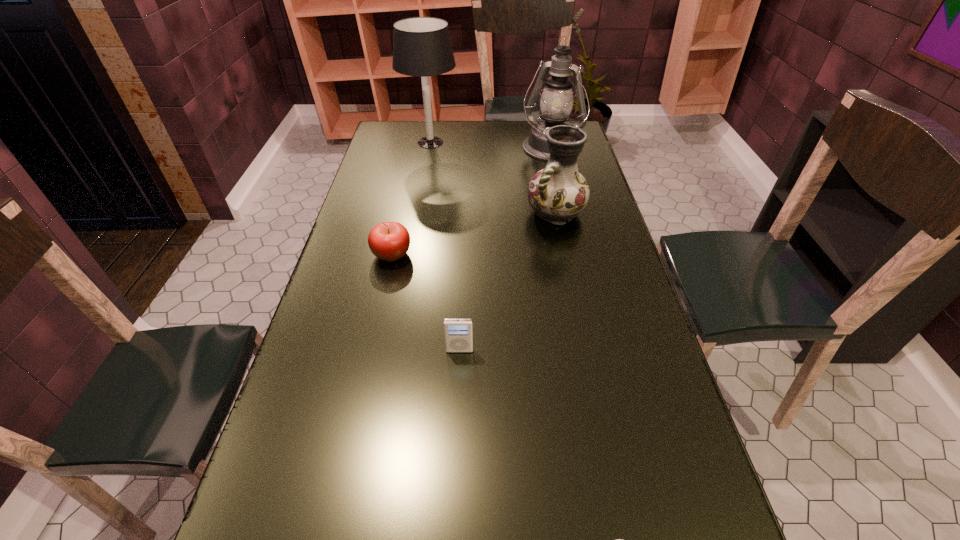
The height and width of the screenshot is (540, 960). I want to click on free space located on the back of the third nearest object, so click(400, 217).

You are a GUI agent. You are given a task and a screenshot of the screen. Output one action in this format:
    pyautogui.click(x=<x>, y=<y>)
    Task: Click on the blank area located on the front-facing side of the iPod
    The width and height of the screenshot is (960, 540).
    Given the screenshot: What is the action you would take?
    (457, 404)

The image size is (960, 540). Identify the location of table lamp that is at the far edge. (422, 47).

Identify the location of oil lamp present at the far edge. (556, 103).

Locate an element on the screen. This screenshot has width=960, height=540. table lamp that is at the left edge is located at coordinates (422, 47).

This screenshot has height=540, width=960. What are the coordinates of `apple situated at the left edge` in the screenshot? It's located at (389, 241).

Identify the location of oil lamp situated at the right edge. (556, 103).

You are a GUI agent. You are given a task and a screenshot of the screen. Output one action in this format:
    pyautogui.click(x=<x>, y=<y>)
    Task: Click on the vase present at the right edge
    This screenshot has height=540, width=960.
    Given the screenshot: What is the action you would take?
    coord(557,193)

This screenshot has width=960, height=540. I want to click on object that is positioned at the far left corner, so click(422, 47).

You are a GUI agent. You are given a task and a screenshot of the screen. Output one action in this format:
    pyautogui.click(x=<x>, y=<y>)
    Task: Click on the object that is at the far right corner
    
    Given the screenshot: What is the action you would take?
    pyautogui.click(x=556, y=103)